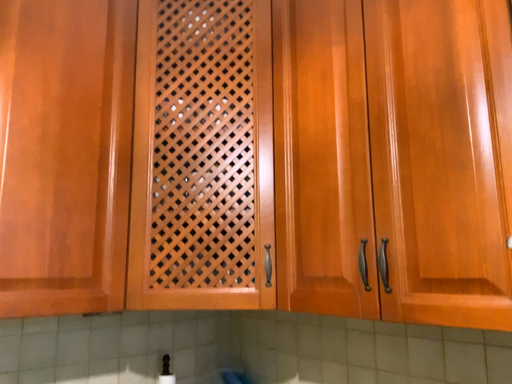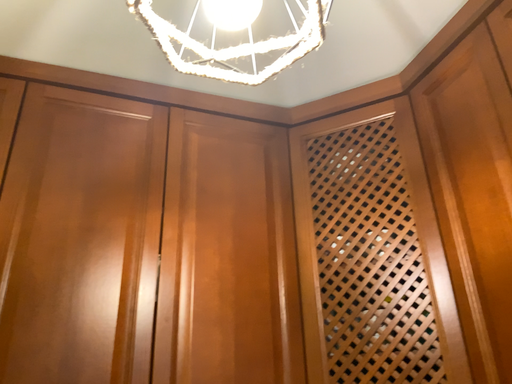
Question: Which way did the camera rotate in the video?

Choices:
 (A) rotated right
 (B) rotated left

Answer: (B)